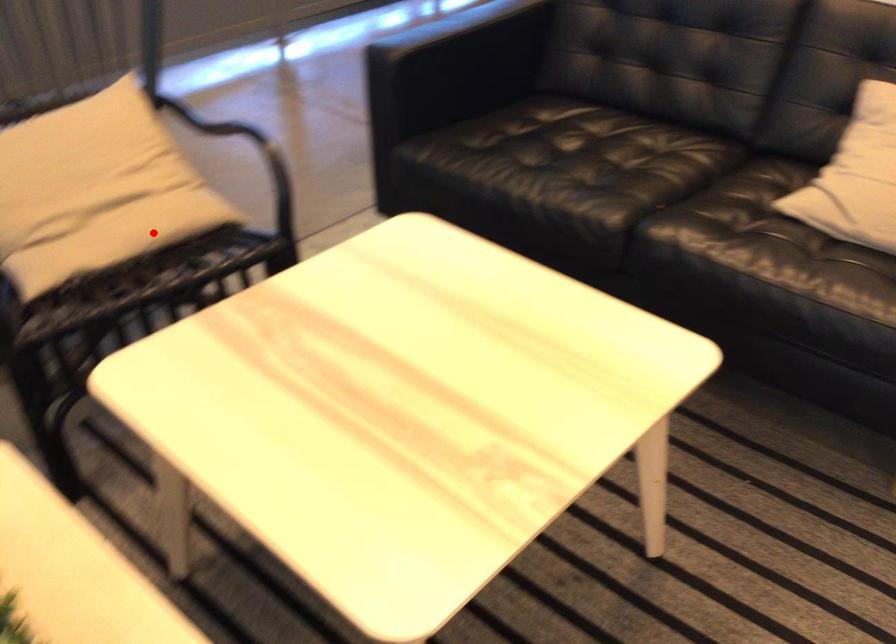
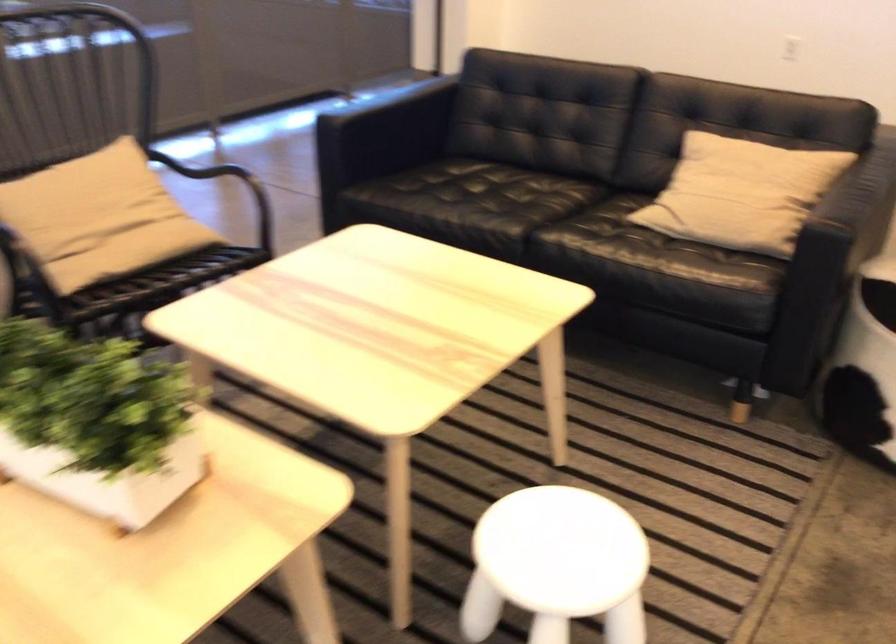
The point at the highlighted location is marked in the first image. Where is the corresponding point in the second image?

(151, 254)